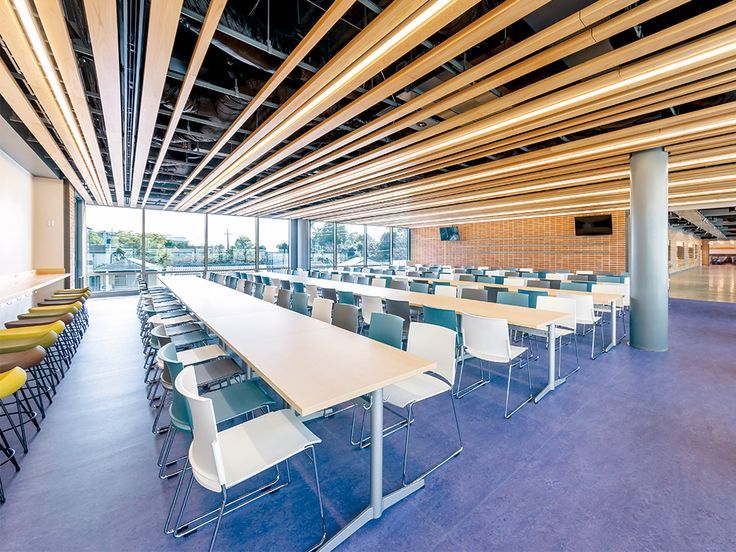
Identify the location of windows. (99, 243), (162, 245), (224, 243), (279, 246), (319, 244), (349, 244), (383, 245), (400, 243).